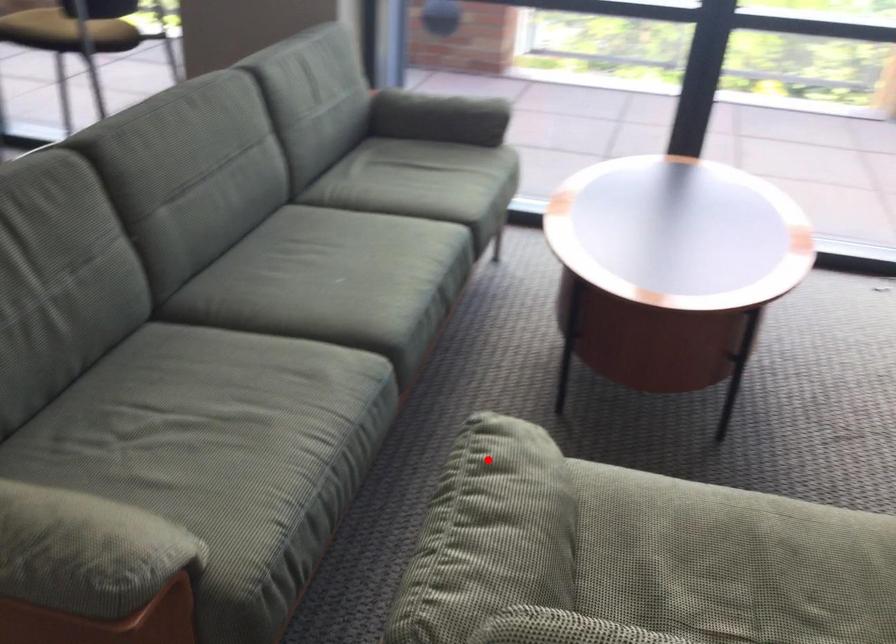
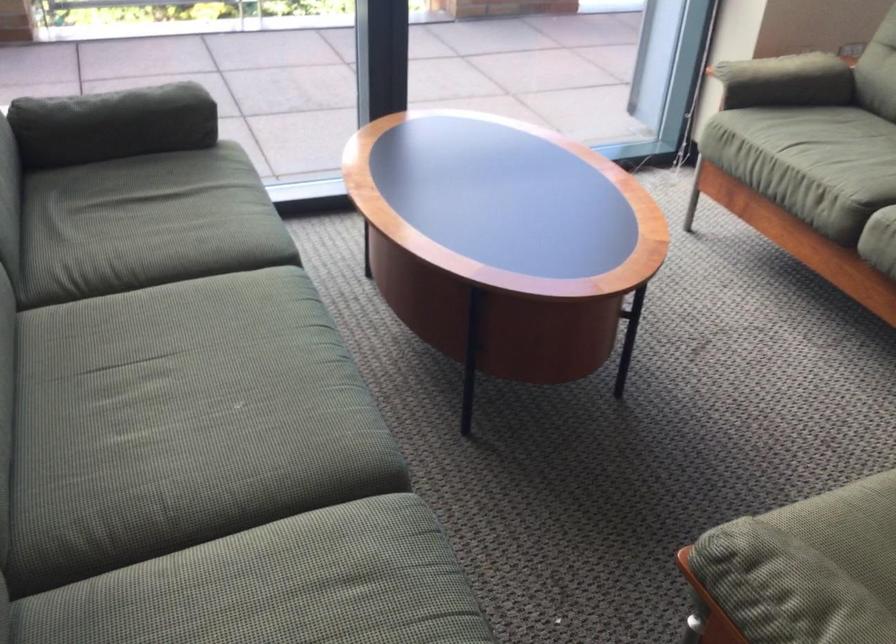
Where in the second image is the point corresponding to the highlighted location from the first image?

(785, 588)